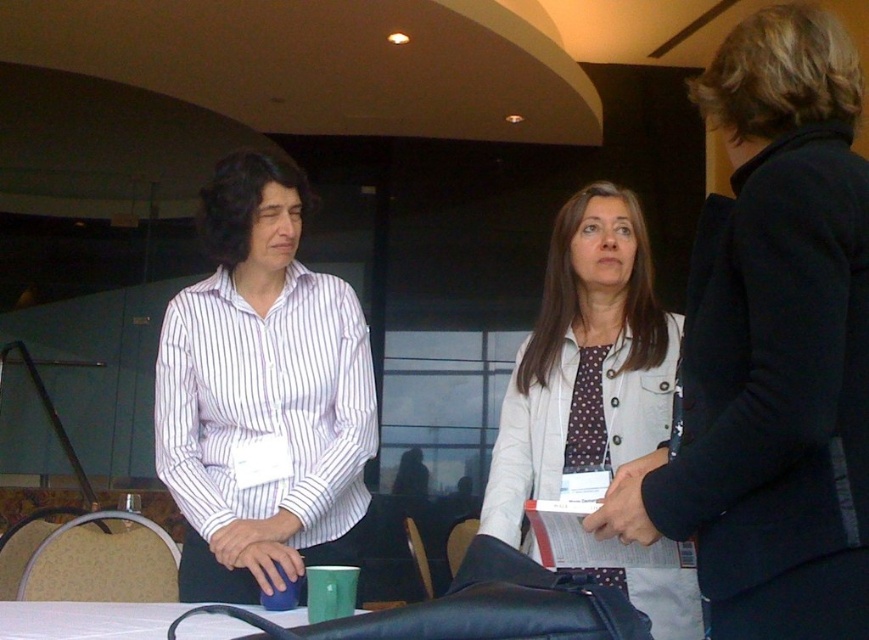
You are standing in the conference room and need to reach a point that is exactly 6.49 feet away from you. Can you confirm if the point at coordinates point [611,337] is at that distance?

The point [611,337] is exactly 6.49 feet away from the viewer, so yes, it is at the required distance.

You are organizing a meeting and need to place a name tag on the white textured jacket at center and the white glossy table at lower center. Which object is higher in position?

The white textured jacket at center is located above the white glossy table at lower center, so the white textured jacket at center is higher in position.